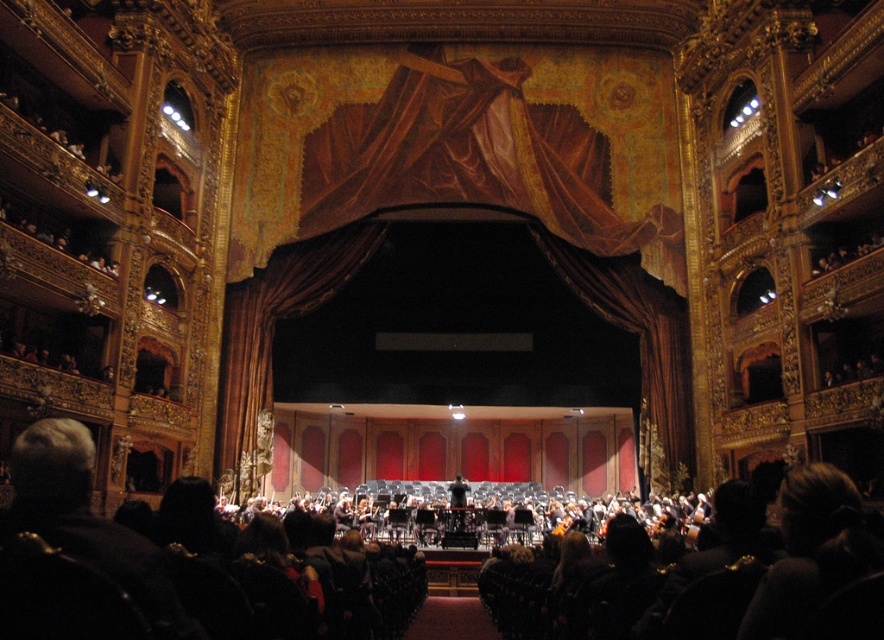
Question: Does velvet drapery at center appear under black smooth conductor at center?

Choices:
 (A) yes
 (B) no

Answer: (B)

Question: Can you confirm if velvet drapery at center is positioned above black smooth conductor at center?

Choices:
 (A) yes
 (B) no

Answer: (A)

Question: Among these points, which one is farthest from the camera?

Choices:
 (A) (459, 529)
 (B) (452, 164)

Answer: (B)

Question: Which object is farther from the camera taking this photo?

Choices:
 (A) velvet drapery at center
 (B) black smooth conductor at center

Answer: (A)

Question: Can you confirm if velvet drapery at center is thinner than black smooth conductor at center?

Choices:
 (A) no
 (B) yes

Answer: (A)